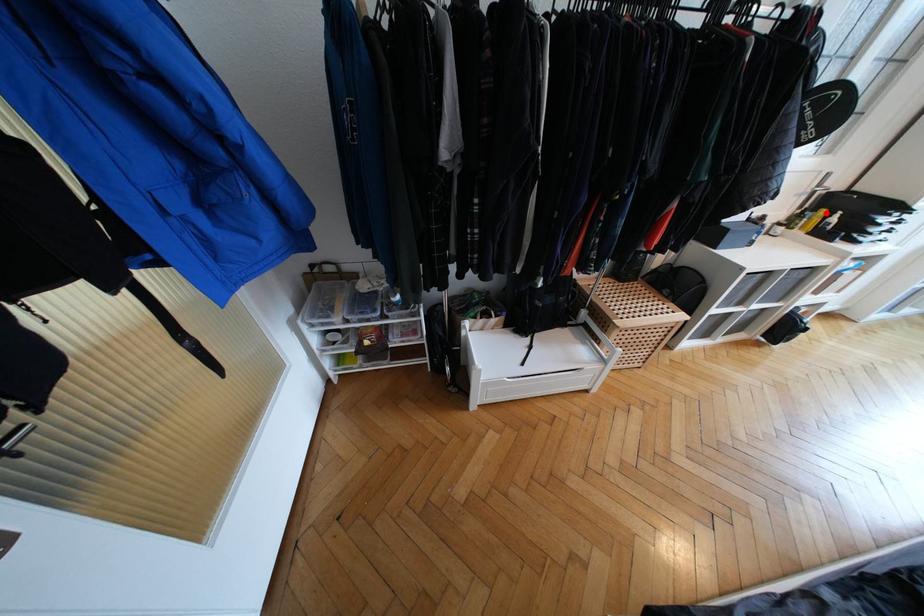
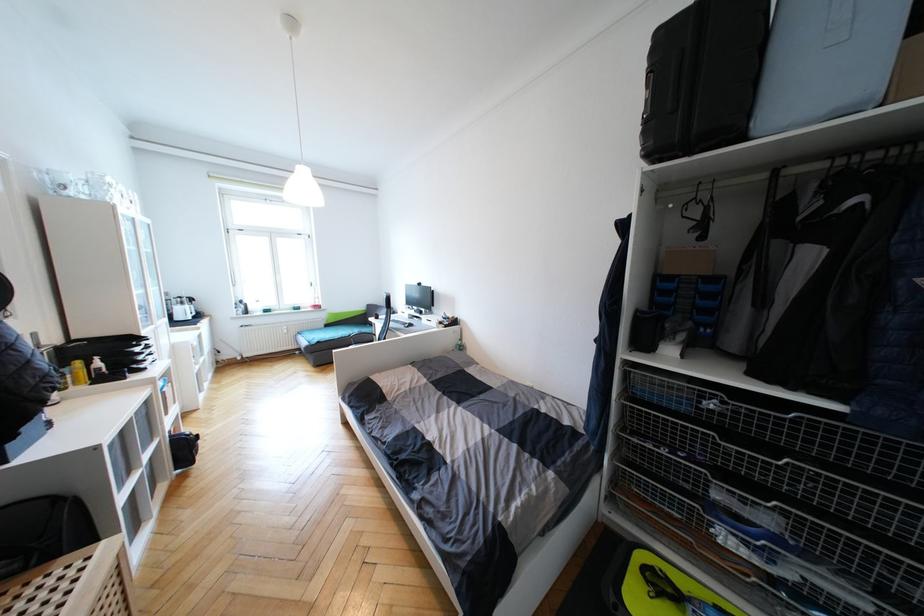
In the second image, find the point that corresponds to the highlighted location in the first image.

(81, 363)